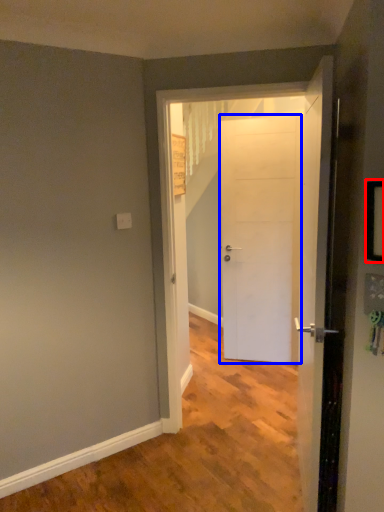
Question: Which object is closer to the camera taking this photo, picture frame (highlighted by a red box) or door (highlighted by a blue box)?

Choices:
 (A) picture frame
 (B) door

Answer: (A)